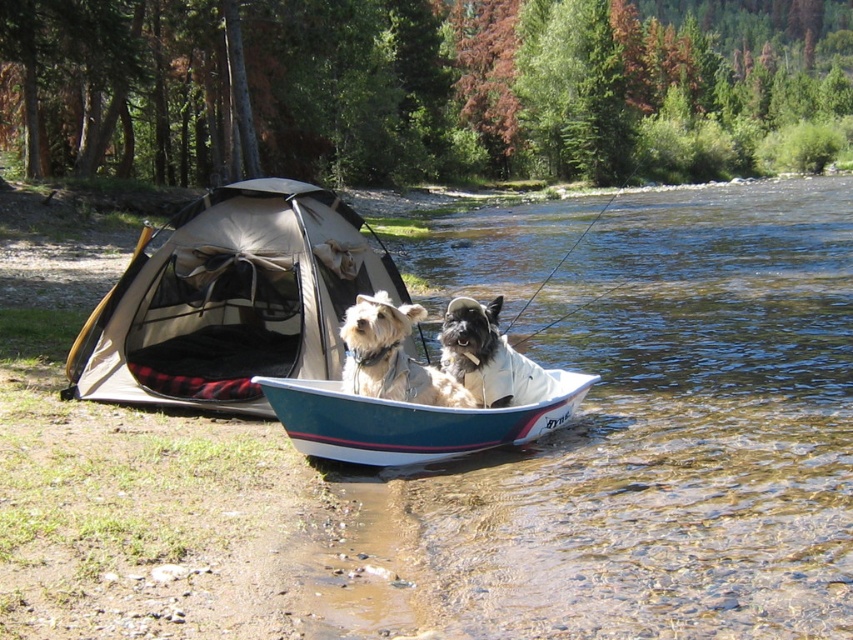
Is light brown fur coat at center below white fur dog at center?

Actually, light brown fur coat at center is above white fur dog at center.

Between light brown fur coat at center and white fur dog at center, which one has more height?

light brown fur coat at center is taller.

Is point (399, 388) farther from viewer compared to point (459, 330)?

No, (399, 388) is closer to viewer.

Where is `light brown fur coat at center`? The image size is (853, 640). light brown fur coat at center is located at coordinates (392, 356).

Who is positioned more to the right, beige canvas tent at left or light brown fur coat at center?

From the viewer's perspective, light brown fur coat at center appears more on the right side.

Is beige canvas tent at left thinner than light brown fur coat at center?

In fact, beige canvas tent at left might be wider than light brown fur coat at center.

Between point (288, 333) and point (383, 349), which one is positioned behind?

The point (288, 333) is behind.

I want to click on beige canvas tent at left, so click(231, 300).

Can you confirm if white plastic canoe at center is taller than light brown fur coat at center?

No.

Is white plastic canoe at center to the left of light brown fur coat at center from the viewer's perspective?

In fact, white plastic canoe at center is to the right of light brown fur coat at center.

Does point (480, 436) come in front of point (409, 332)?

No, (480, 436) is behind (409, 332).

The image size is (853, 640). In order to click on white plastic canoe at center in this screenshot , I will do `click(409, 420)`.